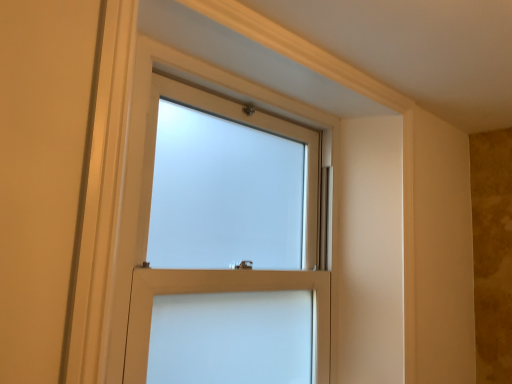
I want to click on clear glass window at upper center, so click(x=216, y=291).

What do you see at coordinates (216, 291) in the screenshot? This screenshot has width=512, height=384. I see `clear glass window at upper center` at bounding box center [216, 291].

Find the location of a particular element. Image resolution: width=512 pixels, height=384 pixels. clear glass window at upper center is located at coordinates (216, 291).